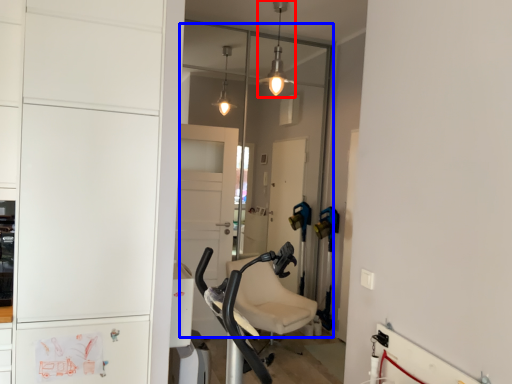
Question: Which object appears farthest to the camera in this image, light fixture (highlighted by a red box) or glass door (highlighted by a blue box)?

Choices:
 (A) light fixture
 (B) glass door

Answer: (B)